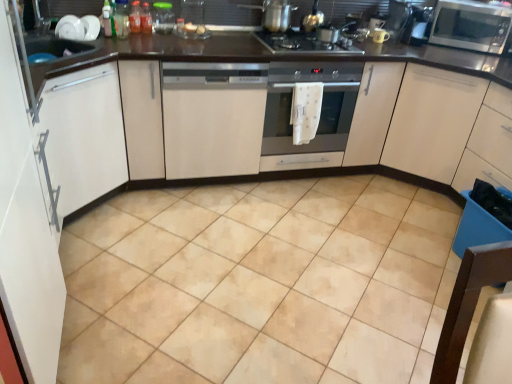
Question: From the image's perspective, relative to beige ceramic tile at center, is satin silver microwave at upper right above or below?

Choices:
 (A) below
 (B) above

Answer: (B)

Question: Considering the relative positions of satin silver microwave at upper right and beige ceramic tile at center in the image provided, is satin silver microwave at upper right to the left or to the right of beige ceramic tile at center?

Choices:
 (A) right
 (B) left

Answer: (A)

Question: Which is farther from the translucent plastic bottle at upper center, arranged as the first bottle when viewed from the left?

Choices:
 (A) white glossy cabinet at left, positioned as the fourth cabinetry in right-to-left order
 (B) blue plastic drawer at lower right
 (C) beige ceramic tile at center
 (D) white matte dishwasher at center, the third cabinetry in the left-to-right sequence
 (E) transparent plastic container at upper center, positioned as the 1th appliance in left-to-right order

Answer: (B)

Question: Which object is positioned closest to the translucent plastic bottle at upper center, which is the second bottle from left to right?

Choices:
 (A) satin silver oven at center
 (B) matte ceramic mug at upper center, the first appliance from the right
 (C) white matte dishwasher at center, the third cabinetry in the left-to-right sequence
 (D) translucent plastic bottle at upper center, arranged as the first bottle when viewed from the left
 (E) white glossy cabinet at left, which is counted as the 1th cabinetry, starting from the left

Answer: (D)